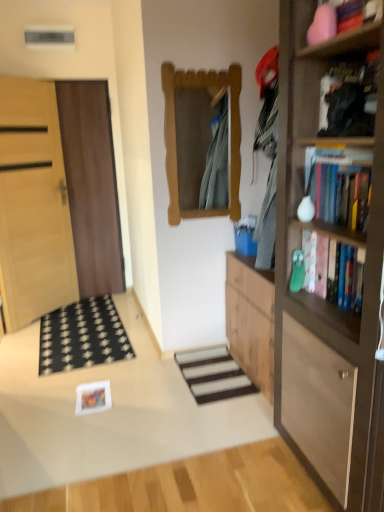
Question: Choose the correct answer: Is hardcover books at right, arranged as the 2th book when viewed from the top, inside black fabric doormat at lower left or outside it?

Choices:
 (A) inside
 (B) outside

Answer: (B)

Question: Considering the positions of point (314, 170) and point (94, 296), is point (314, 170) closer or farther from the camera than point (94, 296)?

Choices:
 (A) farther
 (B) closer

Answer: (B)

Question: Considering the real-world distances, which object is closest to the black fabric doormat at lower left?

Choices:
 (A) wooden bookshelf at upper right
 (B) light wood door at left, the first door viewed from the left
 (C) white striped carpet at center
 (D) brown wooden door at left, the second door in the left-to-right sequence
 (E) hardcover books at right, arranged as the 2th book when viewed from the top

Answer: (C)

Question: Estimate the real-world distances between objects in this image. Which object is closer to the hardcover book at right, which is counted as the first book, starting from the bottom?

Choices:
 (A) black fabric doormat at lower left
 (B) black matte bookshelf at upper right, marked as the 1th book in a top-to-bottom arrangement
 (C) white striped carpet at center
 (D) wooden bookshelf at right
 (E) brown wooden door at left, the second door in the left-to-right sequence

Answer: (D)